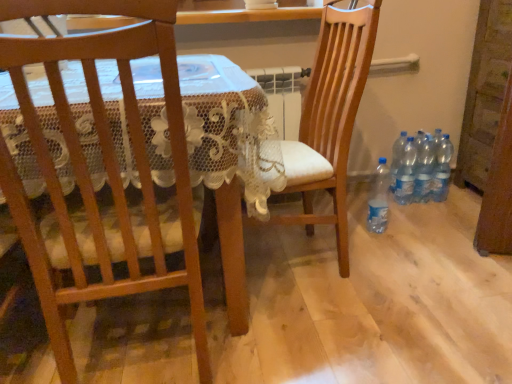
Locate an element on the screen. The width and height of the screenshot is (512, 384). free spot in front of wooden chair at center, the 2th chair from the left is located at coordinates (337, 335).